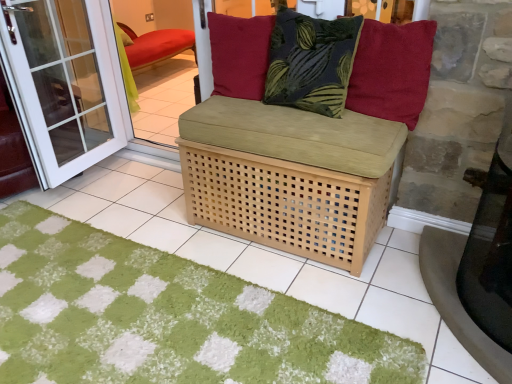
Question: Considering the positions of point (204, 382) and point (272, 203), is point (204, 382) closer or farther from the camera than point (272, 203)?

Choices:
 (A) closer
 (B) farther

Answer: (A)

Question: From a real-world perspective, relative to natural wood basket at center, is green shaggy doormat at center vertically above or below?

Choices:
 (A) below
 (B) above

Answer: (A)

Question: Which is nearer to the green shaggy doormat at center?

Choices:
 (A) smooth concrete table at lower right
 (B) velvet red cushion at upper center, the first pillow positioned from the right
 (C) red velvet cushion at upper center, which is the first pillow from left to right
 (D) natural wood basket at center
 (E) dark green textured pillow at center, arranged as the second pillow when viewed from the right

Answer: (D)

Question: Estimate the real-world distances between objects in this image. Which object is farther from the smooth concrete table at lower right?

Choices:
 (A) natural wood basket at center
 (B) white glass screen door at left
 (C) velvet red cushion at upper center, the first pillow positioned from the right
 (D) green shaggy doormat at center
 (E) red velvet cushion at upper center, the third pillow viewed from the right

Answer: (B)